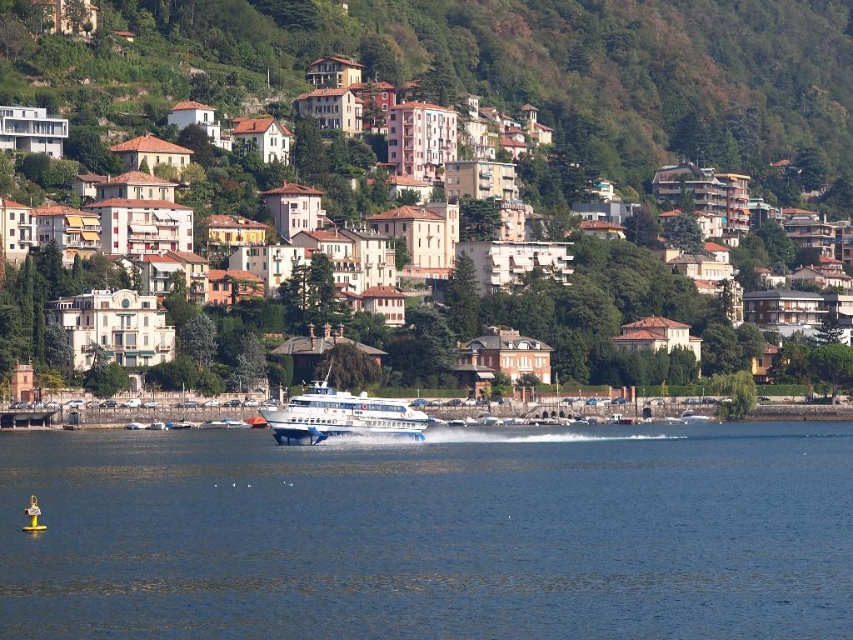
Question: Which point is closer to the camera?

Choices:
 (A) (328, 180)
 (B) (296, 408)

Answer: (B)

Question: Which point is farther to the camera?

Choices:
 (A) white matte buildings at center
 (B) white glossy cruise ship at center
 (C) blue water at center

Answer: (A)

Question: Among these points, which one is nearest to the camera?

Choices:
 (A) (314, 394)
 (B) (532, 301)

Answer: (A)

Question: Can you confirm if blue water at center is positioned to the right of white glossy cruise ship at center?

Choices:
 (A) yes
 (B) no

Answer: (A)

Question: Is white matte buildings at center smaller than white glossy cruise ship at center?

Choices:
 (A) yes
 (B) no

Answer: (B)

Question: Is blue water at center wider than white matte buildings at center?

Choices:
 (A) yes
 (B) no

Answer: (B)